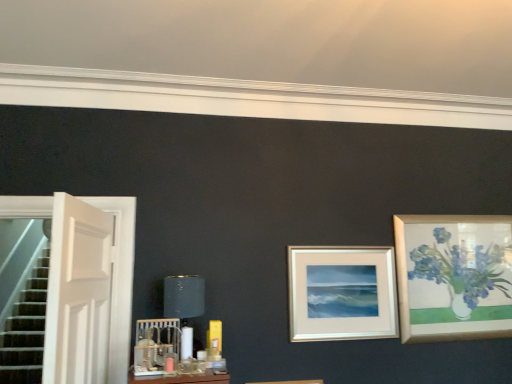
Question: Can you confirm if silver/metallic picture frame at center is smaller than white wooden door at left?

Choices:
 (A) yes
 (B) no

Answer: (A)

Question: Is silver/metallic picture frame at center positioned in front of white wooden door at left?

Choices:
 (A) no
 (B) yes

Answer: (A)

Question: Does silver/metallic picture frame at center contain white wooden door at left?

Choices:
 (A) no
 (B) yes

Answer: (A)

Question: Does silver/metallic picture frame at center have a larger size compared to white wooden door at left?

Choices:
 (A) no
 (B) yes

Answer: (A)

Question: Is silver/metallic picture frame at center to the left of white wooden door at left from the viewer's perspective?

Choices:
 (A) no
 (B) yes

Answer: (A)

Question: Considering the relative sizes of silver/metallic picture frame at center and white wooden door at left in the image provided, is silver/metallic picture frame at center shorter than white wooden door at left?

Choices:
 (A) no
 (B) yes

Answer: (B)

Question: Is matte black lampshade at center taller than white wooden door at left?

Choices:
 (A) yes
 (B) no

Answer: (B)

Question: Considering the relative positions of matte black lampshade at center and white wooden door at left in the image provided, is matte black lampshade at center to the right of white wooden door at left from the viewer's perspective?

Choices:
 (A) yes
 (B) no

Answer: (A)

Question: Can you confirm if matte black lampshade at center is shorter than white wooden door at left?

Choices:
 (A) no
 (B) yes

Answer: (B)

Question: Is matte black lampshade at center oriented towards white wooden door at left?

Choices:
 (A) no
 (B) yes

Answer: (A)

Question: Is matte black lampshade at center not inside white wooden door at left?

Choices:
 (A) yes
 (B) no

Answer: (A)

Question: Does matte black lampshade at center appear on the left side of white wooden door at left?

Choices:
 (A) yes
 (B) no

Answer: (B)

Question: Is white wooden door at left positioned far away from matte black lampshade at center?

Choices:
 (A) no
 (B) yes

Answer: (A)